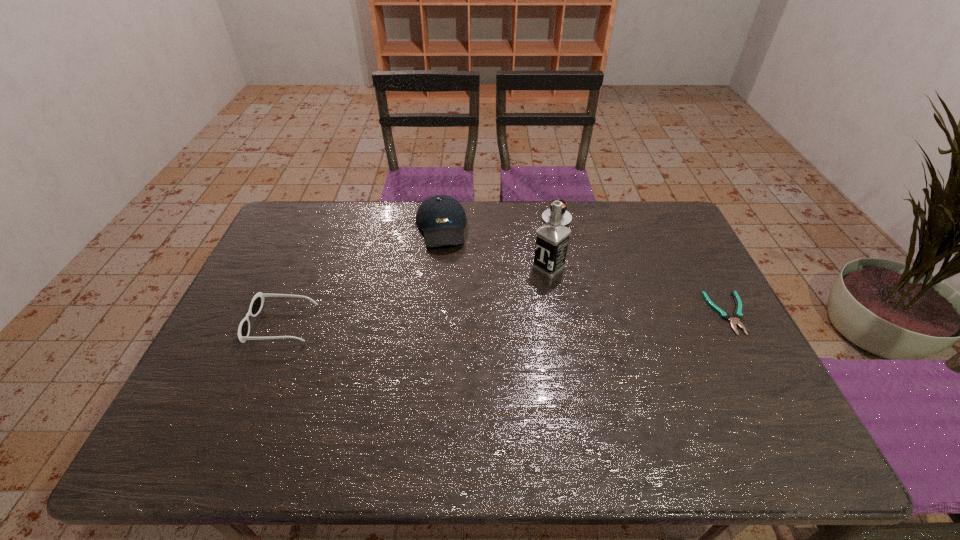
Identify the location of blank region between the fourth shortest object and the leftmost object. The image size is (960, 540). (361, 276).

In order to click on free spot between the tallest object and the fourth shortest object in this screenshot , I will do `click(494, 248)`.

In order to click on free space between the baseball cap and the rightmost object in this screenshot , I will do `click(585, 271)`.

Where is `free spot between the second object from left to right and the third farthest object`? free spot between the second object from left to right and the third farthest object is located at coordinates (494, 248).

You are a GUI agent. You are given a task and a screenshot of the screen. Output one action in this format:
    pyautogui.click(x=<x>, y=<y>)
    Task: Click on the empty space that is in between the cappuccino and the sunglasses
    
    Given the screenshot: What is the action you would take?
    [419, 269]

This screenshot has width=960, height=540. Find the location of `free space between the baseball cap and the pliers`. free space between the baseball cap and the pliers is located at coordinates (585, 271).

Where is `vacant region between the vodka and the rightmost object`? The height and width of the screenshot is (540, 960). vacant region between the vodka and the rightmost object is located at coordinates (638, 291).

The width and height of the screenshot is (960, 540). I want to click on free point between the third nearest object and the fourth shortest object, so click(x=494, y=248).

The width and height of the screenshot is (960, 540). What are the coordinates of `the second closest object to the fourth shortest object` in the screenshot? It's located at (566, 217).

Identify which object is the third nearest to the leftmost object. Please provide its 2D coordinates. Your answer should be formatted as a tuple, i.e. [(x, y)], where the tuple contains the x and y coordinates of a point satisfying the conditions above.

[(566, 217)]